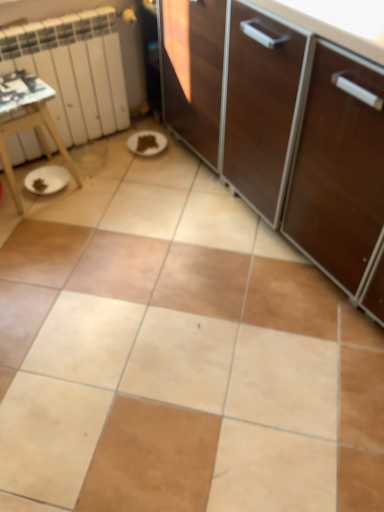
The width and height of the screenshot is (384, 512). I want to click on empty space that is to the right of white matte radiator at left, so click(144, 168).